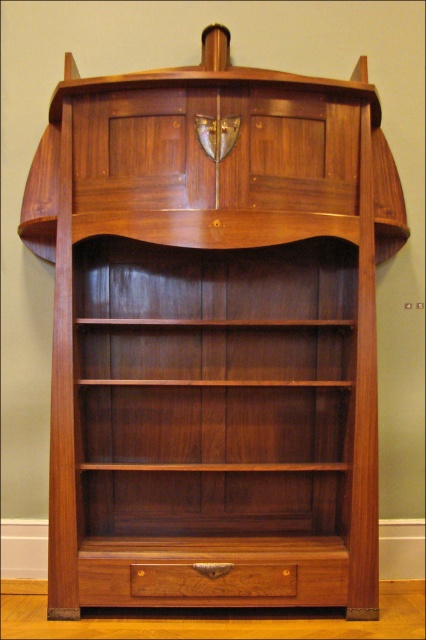
You are standing in front of the wooden bookcase with an Art Nouveau design. You need to reach the brown wood drawer at lower center to retrieve a book. Considering your height, can you comfortably reach it without using a stool?

The brown wood drawer at lower center is 2.31 meters away from the viewer. Since the distance is more than arm length, you would need a stool to comfortably reach it.

You are organizing a collection of vintage books and need to decide which drawer to use. The brown wood drawer at lower center and the polished wood drawer at lower center are available. Which drawer has more vertical space for taller books?

The brown wood drawer at lower center is taller than the polished wood drawer at lower center, so it has more vertical space for taller books.

You are an interior designer assessing the placement of two decorative points on the bookcase. The first point is located at coordinates point (276, 602) and the second at point (172, 580). Which point is closer to the viewer?

Point (172, 580) is closer to the viewer because point (276, 602) is behind it.